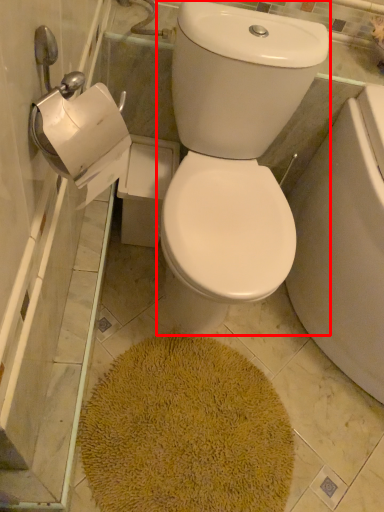
Question: From the image's perspective, what is the correct spatial relationship of toilet bowl (annotated by the red box) in relation to bath mat?

Choices:
 (A) above
 (B) below

Answer: (A)